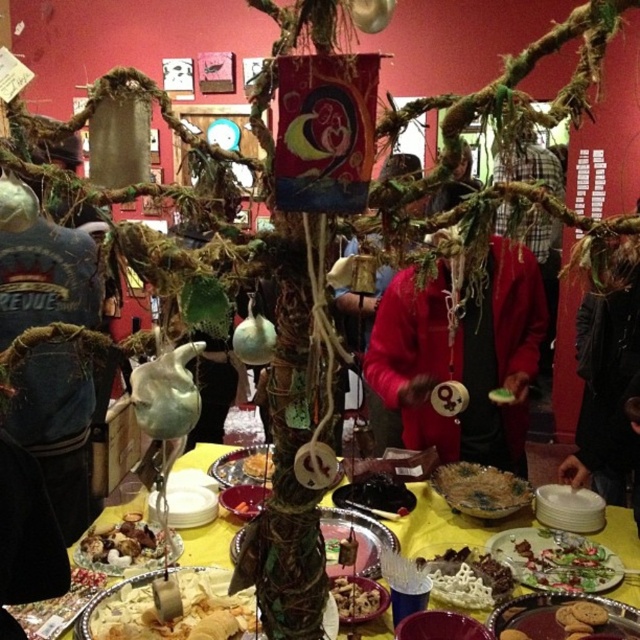
You are at a cultural event and see a table with a brown crumbly cookie at center bottom and a golden brown bread at lower left. Which item is positioned more to the right?

The brown crumbly cookie at center bottom is positioned to the right of the golden brown bread at lower left, so it is more to the right.

You are standing in the room and want to reach both the point at coordinates [628,368] and the point at [552,604]. Which point is closer to you?

Point [628,368] is closer to you because it is further to the viewer than point [552,604].

You are at a cultural event and see the dark gray jacket at center and the brown crumbly cookie at center bottom. If you want to grab the cookie without moving your jacket, is it possible? Please explain.

The dark gray jacket at center and the brown crumbly cookie at center bottom are 30.47 inches apart, so yes, you can reach the cookie without moving the jacket since the distance between them allows for arm movement.